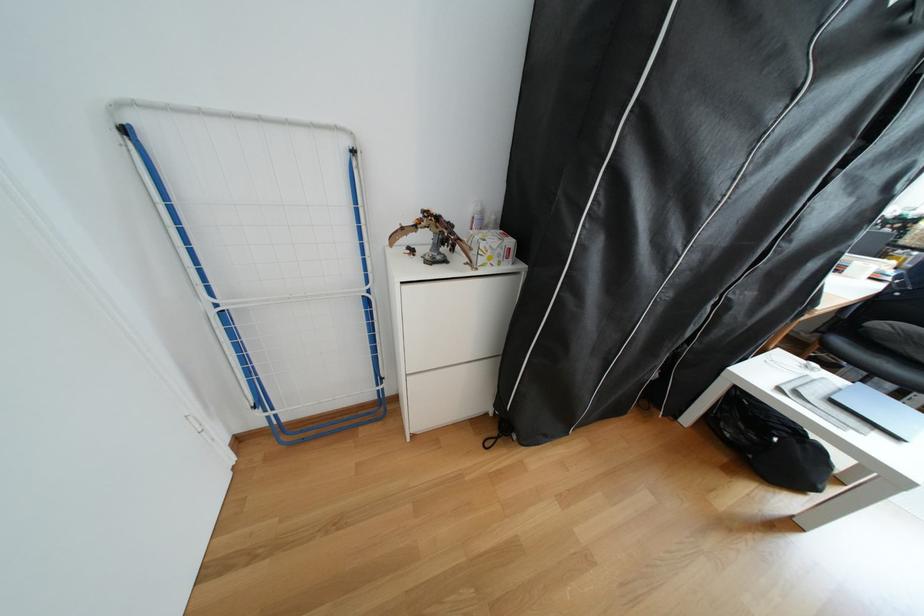
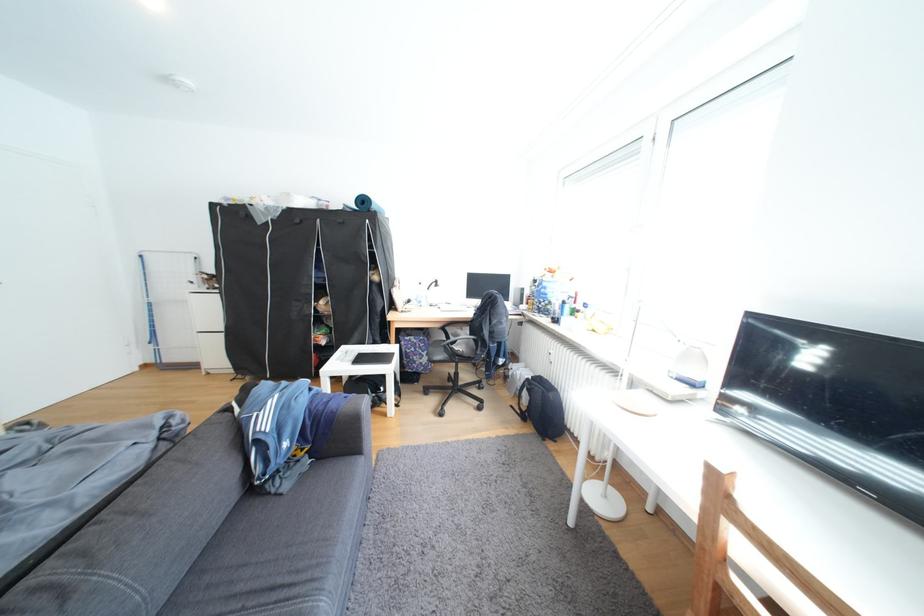
Where in the second image is the point corresponding to point (908, 439) from the first image?

(367, 365)